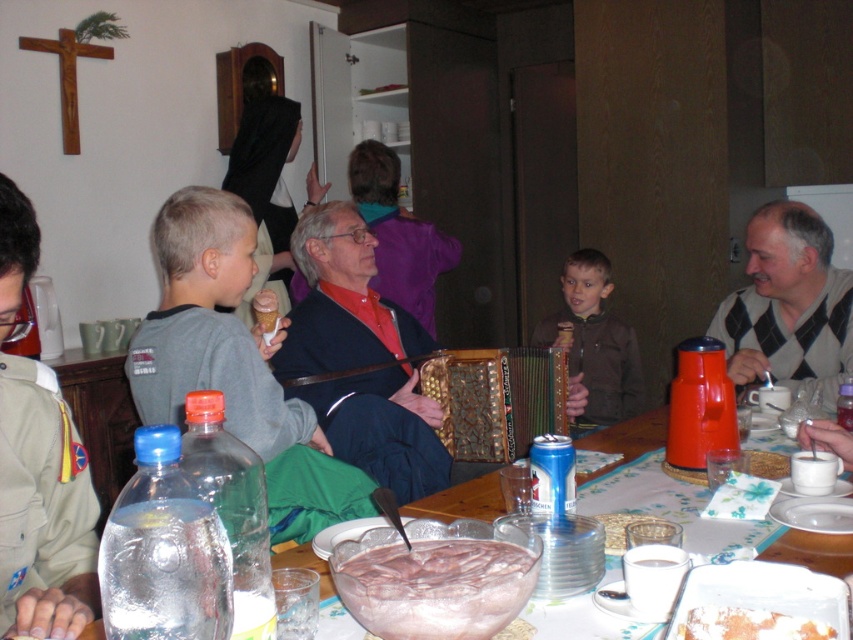
Does point (363, 326) lie behind point (434, 509)?

Yes, it is behind point (434, 509).

Which is in front, point (374, 324) or point (648, 424)?

Point (648, 424) is more forward.

This screenshot has width=853, height=640. What do you see at coordinates (341, 300) in the screenshot?
I see `reddish-brown leather jacket at center` at bounding box center [341, 300].

Locate an element on the screen. The height and width of the screenshot is (640, 853). reddish-brown leather jacket at center is located at coordinates (341, 300).

Does reddish-brown leather jacket at center lie in front of gray sweater at right?

Yes.

Between reddish-brown leather jacket at center and gray sweater at right, which one has less height?

gray sweater at right

Which is in front, point (351, 388) or point (749, 276)?

Positioned in front is point (351, 388).

This screenshot has height=640, width=853. I want to click on reddish-brown leather jacket at center, so click(341, 300).

Does point (463, 547) come closer to viewer compared to point (695, 624)?

No, it is behind (695, 624).

Who is taller, pink frosted cake at center or white crumbly cake at table center?

pink frosted cake at center is taller.

Image resolution: width=853 pixels, height=640 pixels. What do you see at coordinates (434, 586) in the screenshot?
I see `pink frosted cake at center` at bounding box center [434, 586].

You are a GUI agent. You are given a task and a screenshot of the screen. Output one action in this format:
    pyautogui.click(x=<x>, y=<y>)
    Task: Click on the pink frosted cake at center
    Image resolution: width=853 pixels, height=640 pixels.
    Given the screenshot: What is the action you would take?
    pyautogui.click(x=434, y=586)